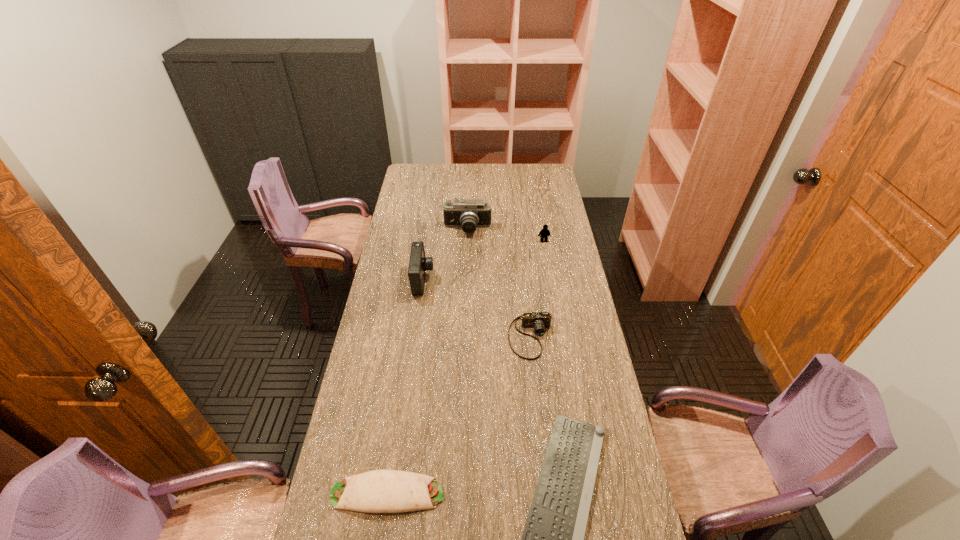
Where is `the farthest camera`? the farthest camera is located at coordinates (469, 214).

Locate an element on the screen. This screenshot has height=540, width=960. the second camera from left to right is located at coordinates (469, 214).

You are a GUI agent. You are given a task and a screenshot of the screen. Output one action in this format:
    pyautogui.click(x=<x>, y=<y>)
    Task: Click on the second nearest camera
    The width and height of the screenshot is (960, 540).
    Given the screenshot: What is the action you would take?
    pyautogui.click(x=418, y=264)

Find the location of a particular element. The width and height of the screenshot is (960, 540). the leftmost camera is located at coordinates (418, 264).

Identify the location of Lego. (545, 233).

Identify the location of the fourth shortest object. The image size is (960, 540). (545, 233).

In order to click on the fourth tallest object in this screenshot , I will do `click(539, 321)`.

Identify the location of the shortest camera. The image size is (960, 540). (539, 321).

Identify the location of burrito. The image size is (960, 540). (379, 491).

Where is `vacant space located 0.140m on the front-facing side of the farthest object`? This screenshot has width=960, height=540. vacant space located 0.140m on the front-facing side of the farthest object is located at coordinates (467, 258).